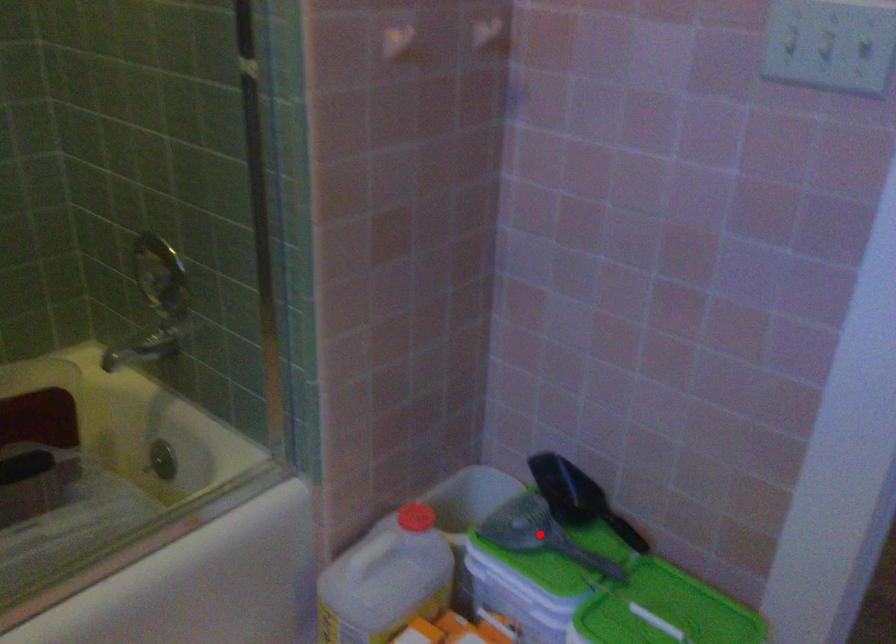
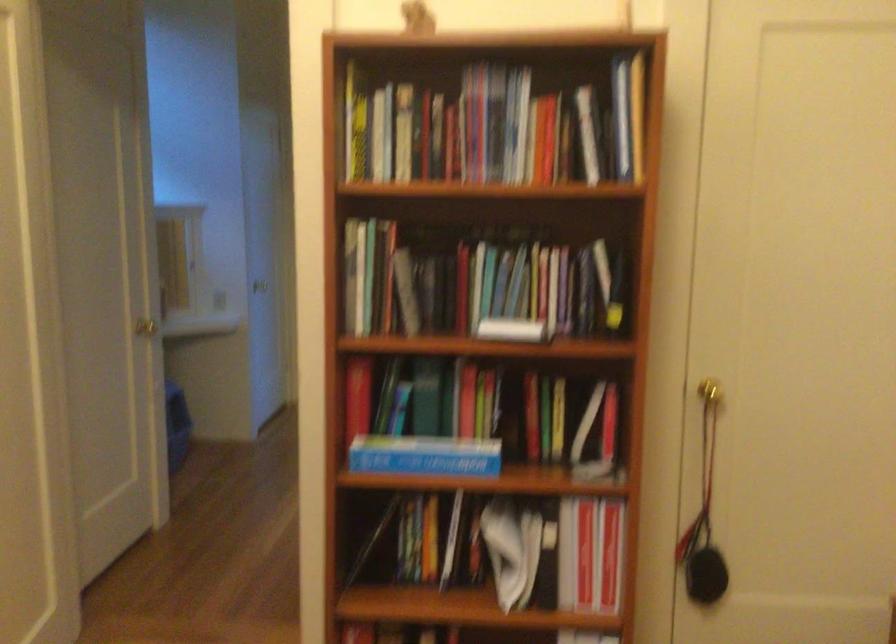
Question: I am providing you with two images of the same scene from different viewpoints. A red point is marked on the first image. Is the red point's position out of view in image 2?

Choices:
 (A) Yes
 (B) No

Answer: (A)